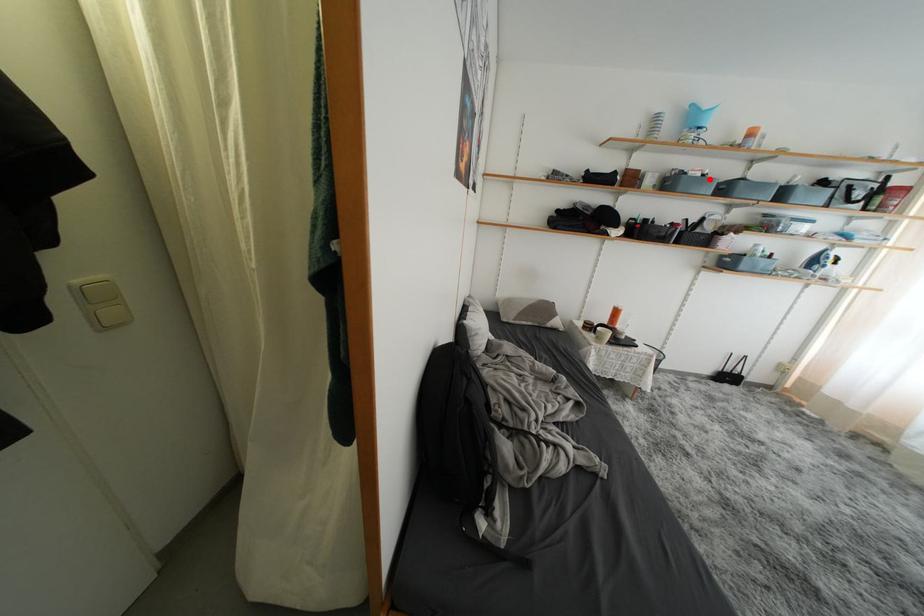
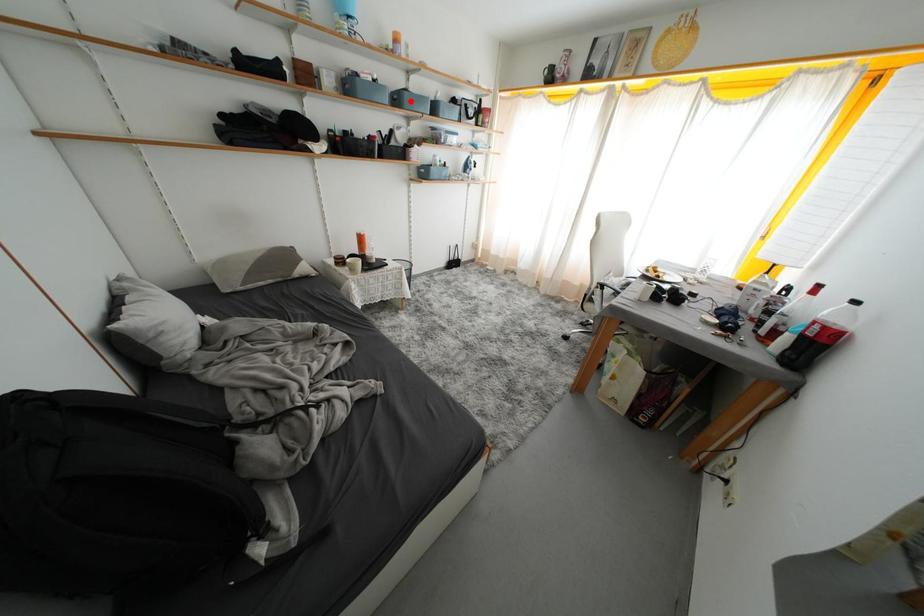
I am providing you with two images of the same scene from different viewpoints. A red point is marked on the first image and another point is marked on the second image. Are the points marked in image1 and image2 representing the same 3D position?

No